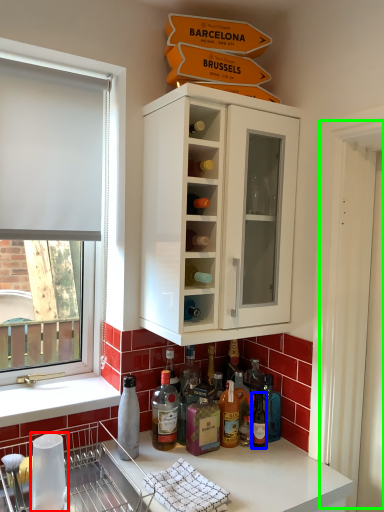
Question: Which is farther away from appliance (highlighted by a red box)? bottle (highlighted by a blue box) or screen door (highlighted by a green box)?

Choices:
 (A) bottle
 (B) screen door

Answer: (B)